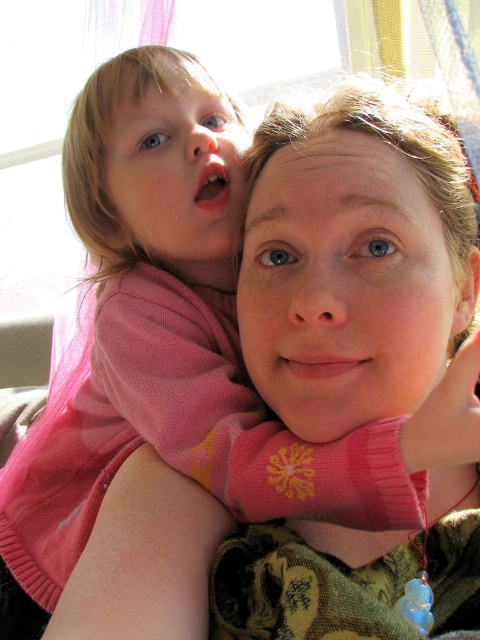
Based on the coordinates provided in the scene description, where exactly is the smooth skin face at center located?

The smooth skin face at center is located at point coordinates of [344,285].

You are a photographer trying to capture a close portrait of the smooth skin face at center and the matte pink sweater at upper left. Since you want to focus on the face, which object should you ensure is positioned closer to the camera lens?

The smooth skin face at center is much taller than the matte pink sweater at upper left, so to focus on the face, position the smooth skin face at center closer to the camera lens.